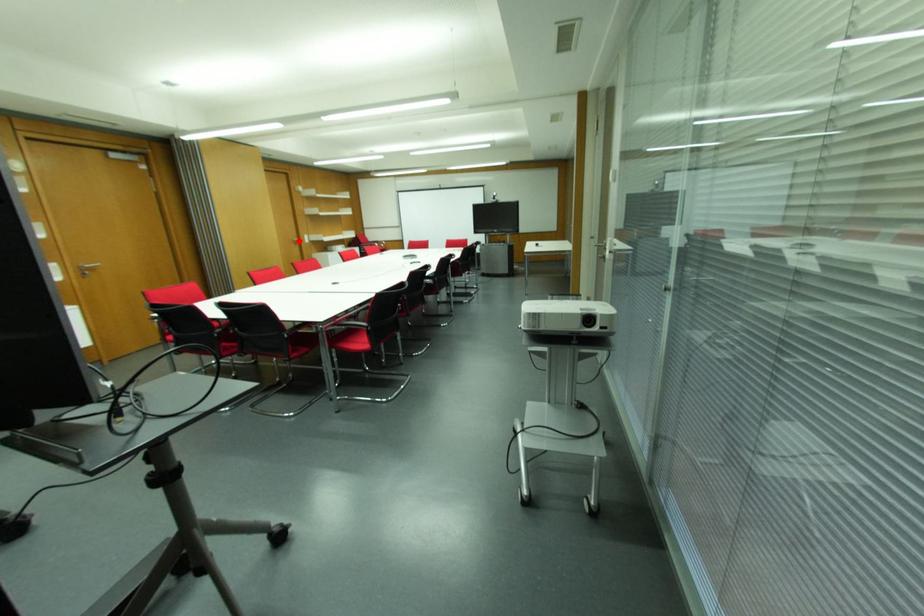
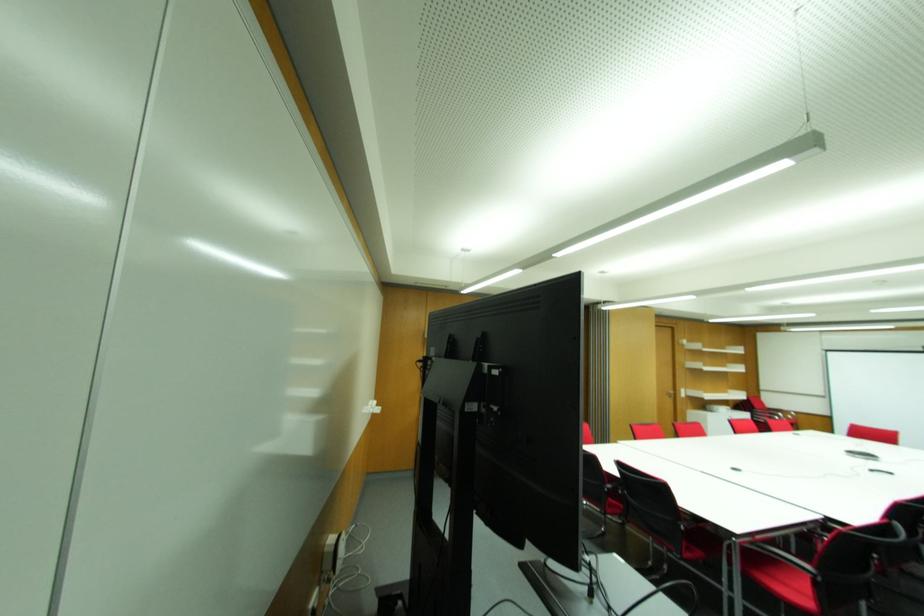
In the second image, find the point that corresponds to the highlighted location in the first image.

(675, 394)